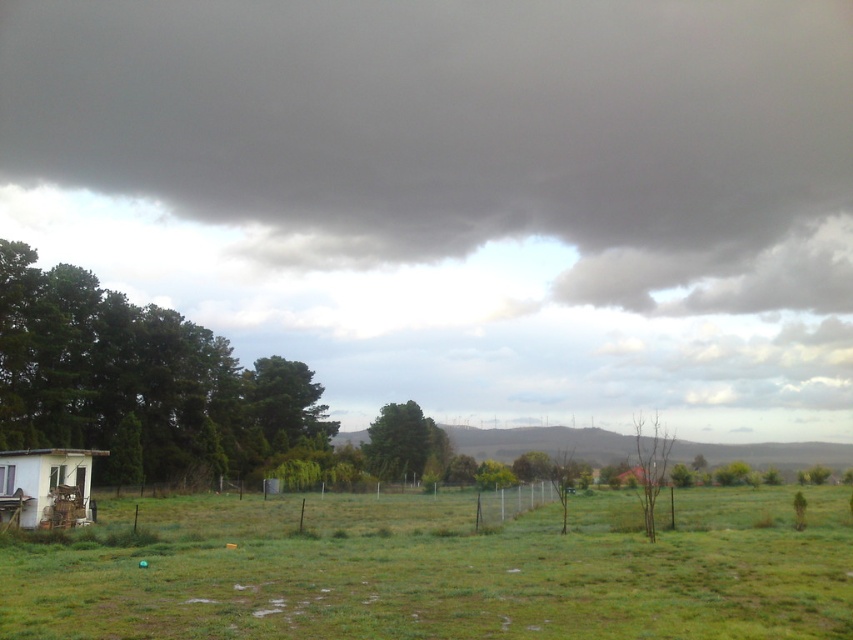
Question: Can you confirm if green leafy tree at center is positioned below green matte tree at center?

Choices:
 (A) yes
 (B) no

Answer: (B)

Question: Is rustic wood hut at lower left smaller than green leafy tree at center?

Choices:
 (A) no
 (B) yes

Answer: (B)

Question: Which object appears farthest from the camera in this image?

Choices:
 (A) green leafy tree at left
 (B) dark gray cloud at upper center
 (C) rustic wood hut at lower left

Answer: (B)

Question: Can you confirm if green leafy tree at center is smaller than bare wood tree at center-right?

Choices:
 (A) no
 (B) yes

Answer: (B)

Question: Which point is closer to the camera?

Choices:
 (A) rustic wood hut at lower left
 (B) green matte tree at center

Answer: (A)

Question: Based on their relative distances, which object is farther from the brown wooden hut at lower right?

Choices:
 (A) green matte tree at center
 (B) dark gray cloud at upper center
 (C) rustic wood hut at lower left

Answer: (B)